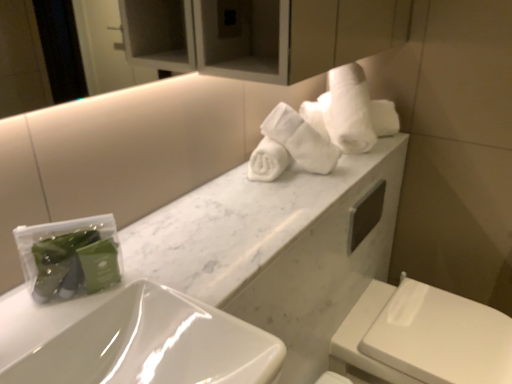
Question: Looking at their shapes, would you say white glossy sink at lower left is wider or thinner than white soft towel at upper right?

Choices:
 (A) thin
 (B) wide

Answer: (B)

Question: Considering the positions of white glossy sink at lower left and white soft towel at upper right in the image, is white glossy sink at lower left taller or shorter than white soft towel at upper right?

Choices:
 (A) short
 (B) tall

Answer: (A)

Question: Based on their relative distances, which object is nearer to the white marble countertop at center?

Choices:
 (A) white glossy sink at lower left
 (B) white soft towel at upper right
 (C) white glossy toilet at lower right

Answer: (B)

Question: Which is farther from the white glossy toilet at lower right?

Choices:
 (A) white soft towel at upper right
 (B) white marble countertop at center
 (C) white glossy sink at lower left

Answer: (C)